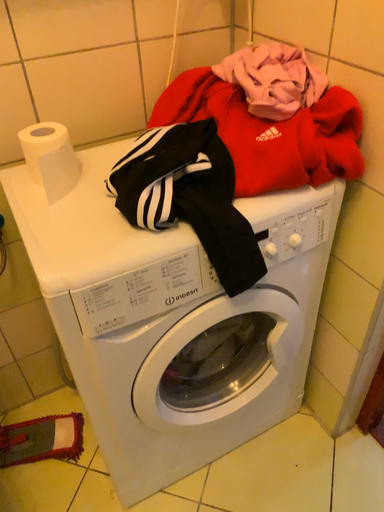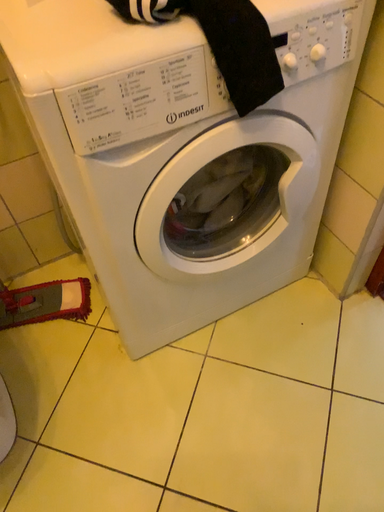
Question: Which way did the camera rotate in the video?

Choices:
 (A) rotated upward
 (B) rotated downward

Answer: (B)